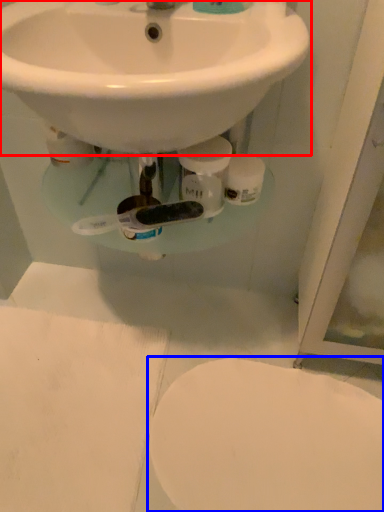
Question: Which object is further to the camera taking this photo, sink (highlighted by a red box) or toilet (highlighted by a blue box)?

Choices:
 (A) sink
 (B) toilet

Answer: (B)